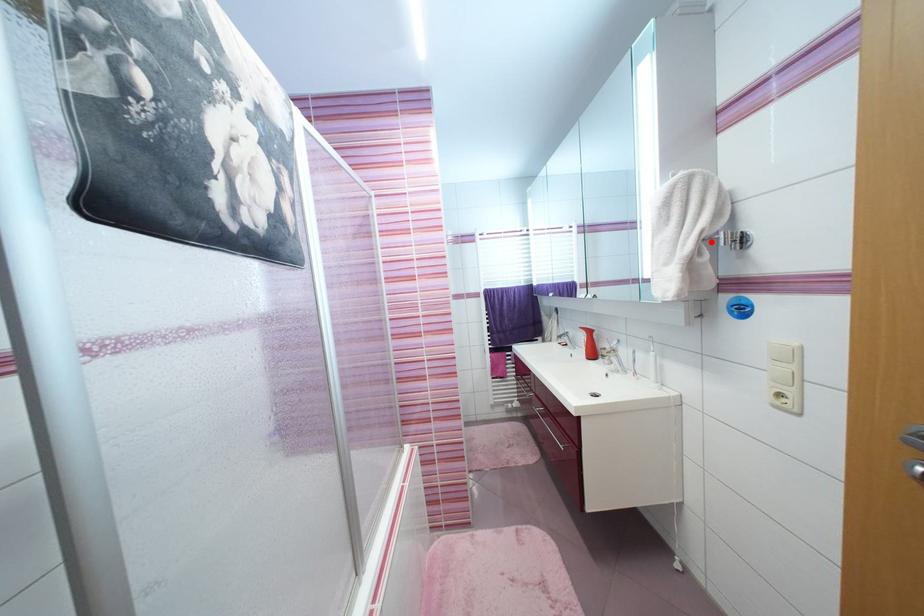
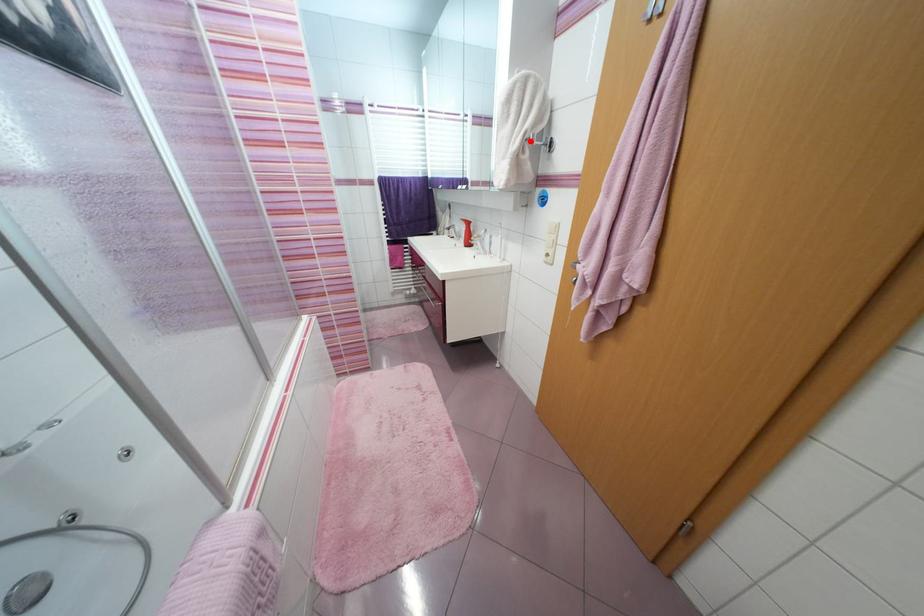
I am providing you with two images of the same scene from different viewpoints. A red point is marked on the first image and another point is marked on the second image. Are the points marked in image1 and image2 representing the same 3D position?

Yes